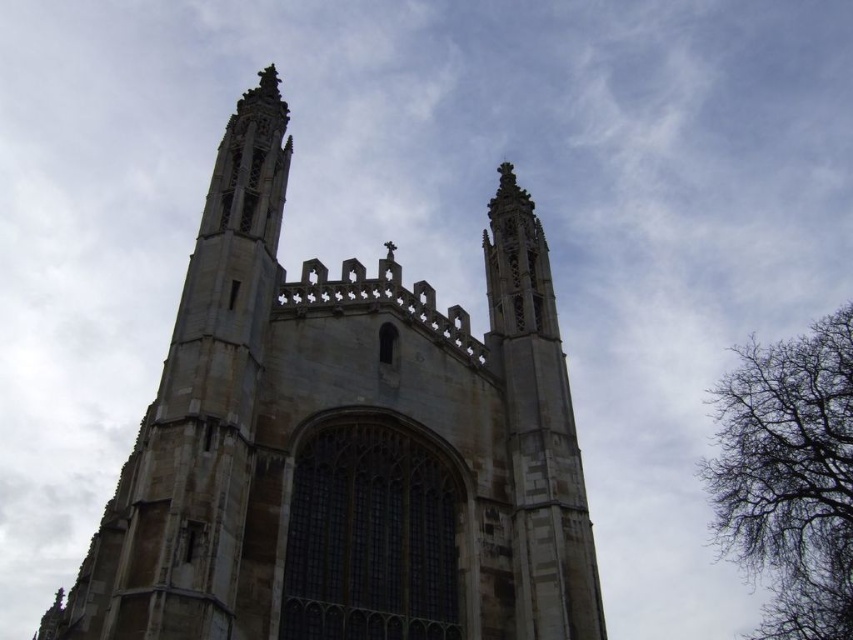
Question: Does stone church at center appear over bare branches at right?

Choices:
 (A) no
 (B) yes

Answer: (B)

Question: Considering the relative positions of stone church at center and bare branches at right in the image provided, where is stone church at center located with respect to bare branches at right?

Choices:
 (A) right
 (B) left

Answer: (B)

Question: Which object is closer to the camera taking this photo?

Choices:
 (A) bare branches at right
 (B) stone church at center

Answer: (B)

Question: Among these points, which one is nearest to the camera?

Choices:
 (A) (778, 376)
 (B) (573, 570)

Answer: (B)

Question: Is stone church at center thinner than bare branches at right?

Choices:
 (A) yes
 (B) no

Answer: (B)

Question: Which point appears farthest from the camera in this image?

Choices:
 (A) (289, 141)
 (B) (811, 547)

Answer: (B)